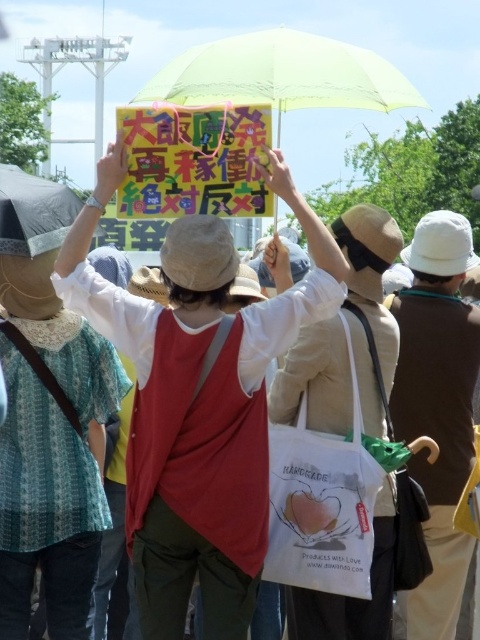
Which of these two, matte white shirt at center or white fabric bag at center, stands taller?

white fabric bag at center is taller.

Consider the image. Is matte white shirt at center above white fabric bag at center?

Correct, matte white shirt at center is located above white fabric bag at center.

Image resolution: width=480 pixels, height=640 pixels. In order to click on matte white shirt at center in this screenshot , I will do `click(197, 403)`.

In the scene shown: Is the position of matte white shirt at center less distant than that of matte black umbrella at upper left?

Yes, matte white shirt at center is in front of matte black umbrella at upper left.

Who is more distant from viewer, (173, 605) or (60, 228)?

Point (60, 228)

Who is more distant from viewer, (226, 516) or (7, 170)?

Point (7, 170)

Identify the location of matte white shirt at center. This screenshot has width=480, height=640. (197, 403).

Which is more to the left, white fabric bag at center or transparent yellow umbrella at upper center?

transparent yellow umbrella at upper center is more to the left.

Does white fabric bag at center have a greater height compared to transparent yellow umbrella at upper center?

Correct, white fabric bag at center is much taller as transparent yellow umbrella at upper center.

I want to click on white fabric bag at center, so click(x=437, y=404).